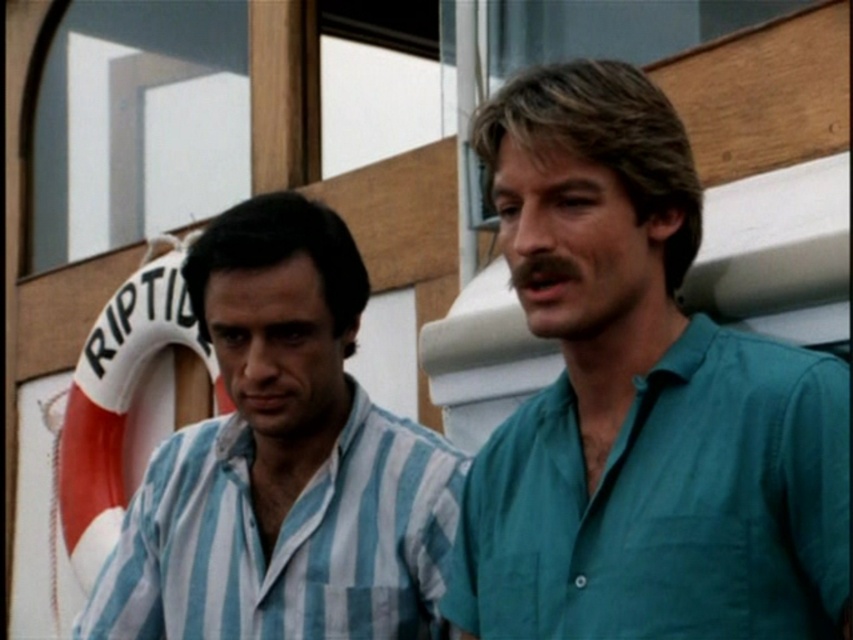
In the scene shown: Is teal cotton shirt at right wider than blue striped shirt at left?

Yes, teal cotton shirt at right is wider than blue striped shirt at left.

Is point (703, 413) in front of point (230, 536)?

Yes, it is in front of point (230, 536).

Where is `teal cotton shirt at right`? Image resolution: width=853 pixels, height=640 pixels. teal cotton shirt at right is located at coordinates (640, 403).